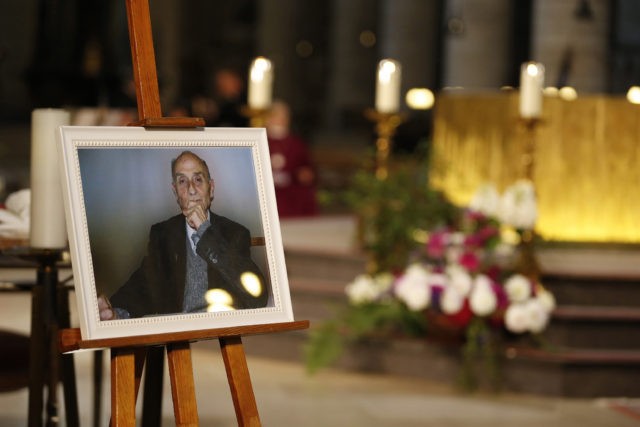
At what (x,y) coordinates should I click in order to perform the action: click on floor. Please return your answer as a coordinate pair (x, y). Looking at the image, I should click on (324, 398).